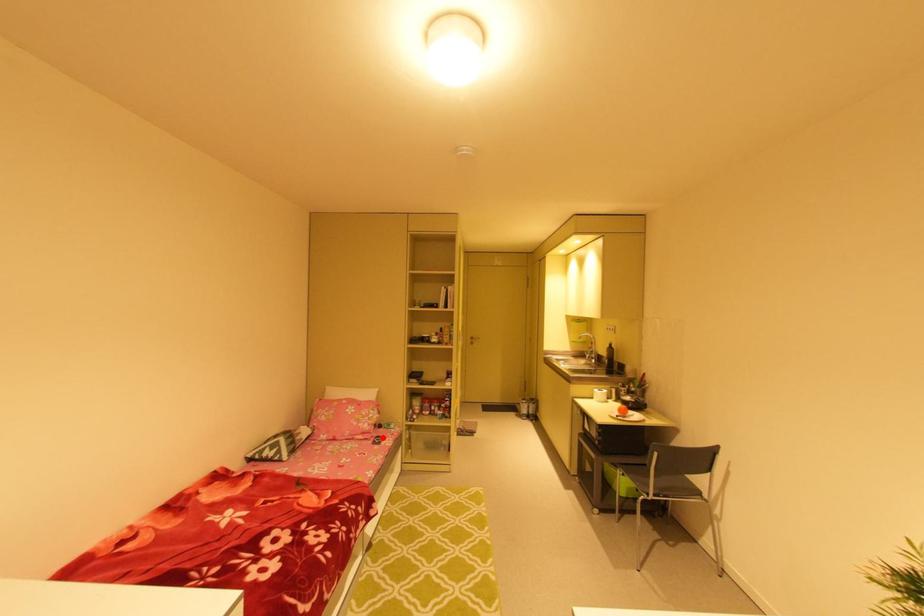
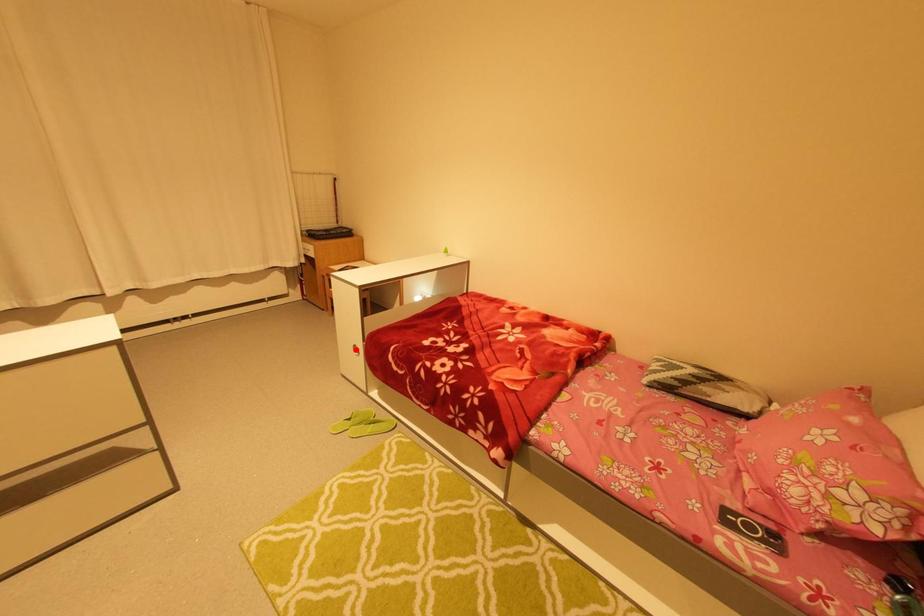
I am providing you with two images of the same scene from different viewpoints. A red point is marked on the first image and another point is marked on the second image. Do the highlighted points in image1 and image2 indicate the same real-world spot?

No